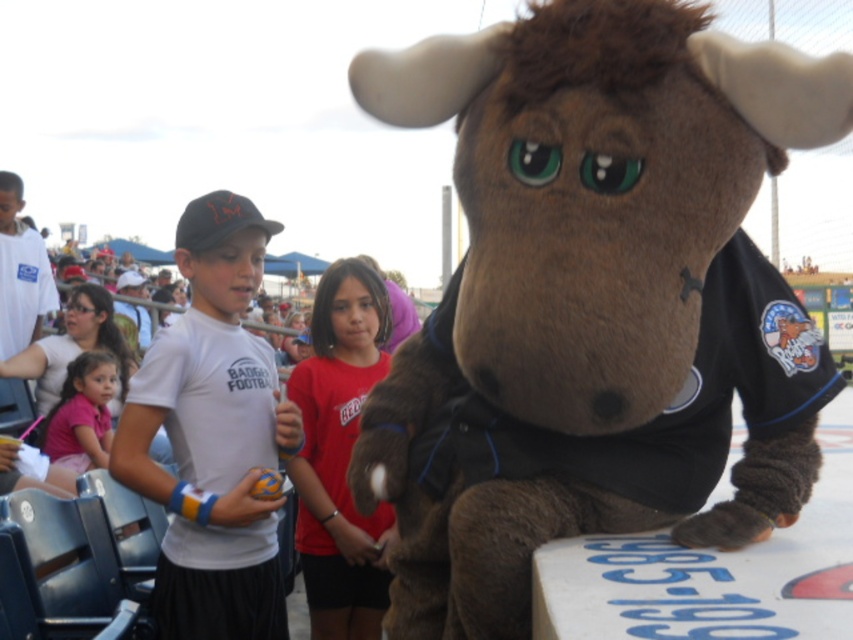
Which is behind, point (370, 276) or point (67, 406)?

Point (67, 406)

Does point (378, 352) come in front of point (80, 428)?

Yes, it is.

This screenshot has height=640, width=853. Identify the location of matte red shirt at center. (340, 456).

Who is positioned more to the right, brown plush moose at center or matte red shirt at center?

brown plush moose at center

Does point (463, 70) come behind point (346, 602)?

No, it is not.

Between point (468, 416) and point (318, 556), which one is positioned behind?

Positioned behind is point (318, 556).

Find the location of a particular element. This screenshot has width=853, height=640. brown plush moose at center is located at coordinates (595, 301).

Consider the image. Which is below, brown plush moose at center or pink fabric shirt at lower left?

pink fabric shirt at lower left is lower down.

Is brown plush moose at center positioned behind pink fabric shirt at lower left?

No, brown plush moose at center is in front of pink fabric shirt at lower left.

Describe the element at coordinates (595, 301) in the screenshot. I see `brown plush moose at center` at that location.

What are the coordinates of `brown plush moose at center` in the screenshot? It's located at (595, 301).